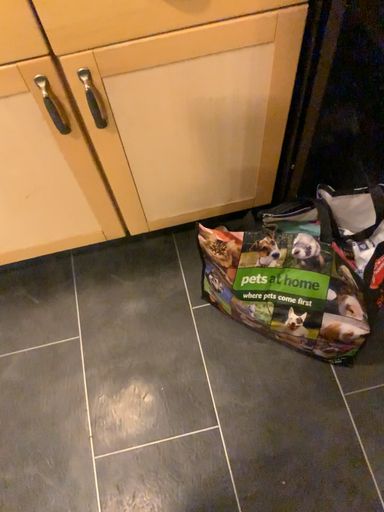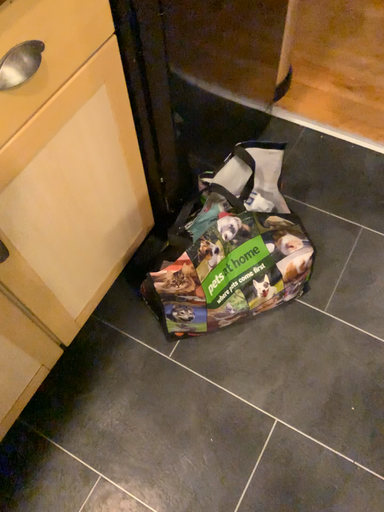
Question: How did the camera likely rotate when shooting the video?

Choices:
 (A) rotated upward
 (B) rotated downward

Answer: (A)